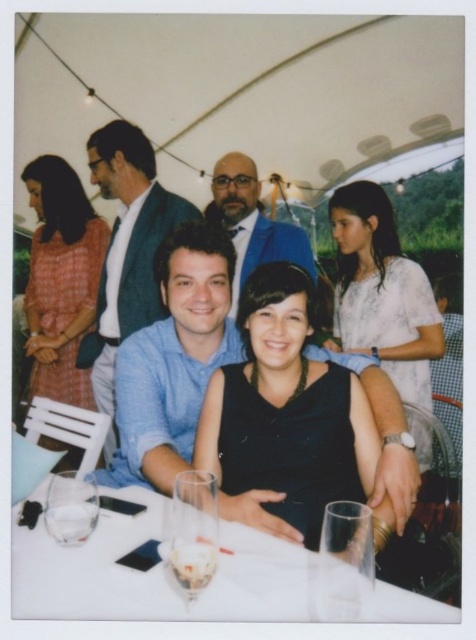
You are a photographer at the event and need to capture a shot of both the blue shirt at center and the clear glass wine glass at lower center without any obstruction. Based on their positions, can you position yourself so that both are fully visible in the frame?

The blue shirt at center is positioned over the clear glass wine glass at lower center, so if you position yourself slightly above or to the side, you can ensure both are visible without obstruction.

You are a photographer standing at a distance and want to take a closeup shot of the clear glass wine glass at lower center. The camera you are using has a minimum focusing distance of 30 inches. Can you take the photo without moving closer?

The clear glass wine glass at lower center is 33.68 inches away from viewer. Since the minimum focusing distance is 30 inches, the photographer can take the closeup shot without moving closer as the distance is sufficient.

In the scene shown: You are a photographer at the event and want to capture a closeup of the clear glassware at center without the white textured blouse at upper right appearing in the frame. Is this possible based on their sizes?

The clear glassware at center is not as tall as the white textured blouse at upper right, so it might be challenging to frame the shot without the blouse appearing, as the blouse is taller. Adjusting the camera angle or moving closer could help isolate the glassware.